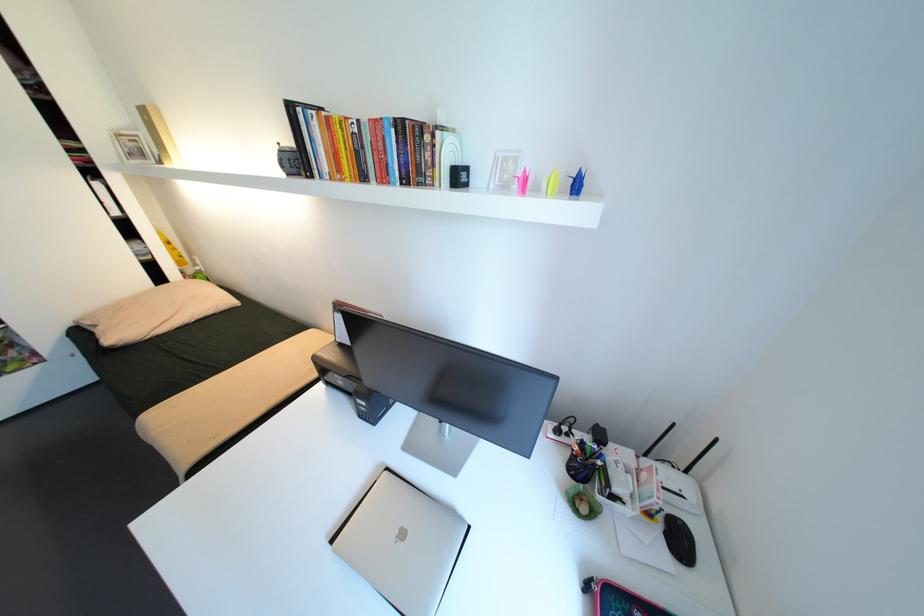
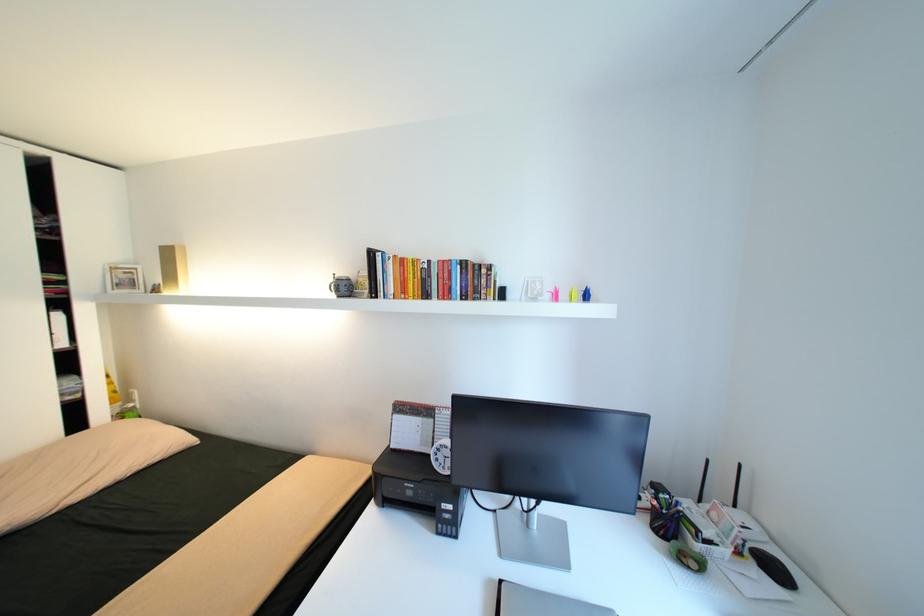
Where in the second image is the point corresponding to point 673,535 from the first image?

(769, 567)